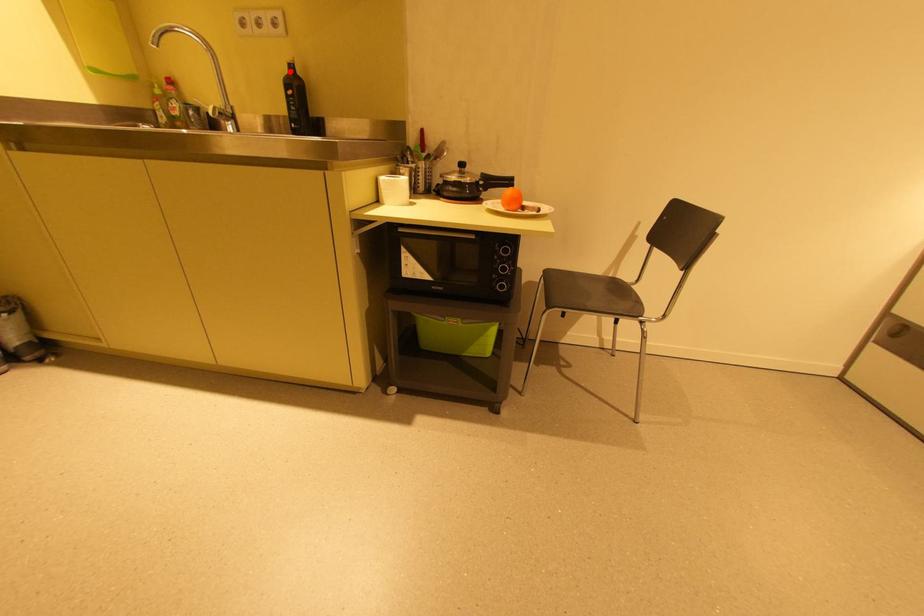
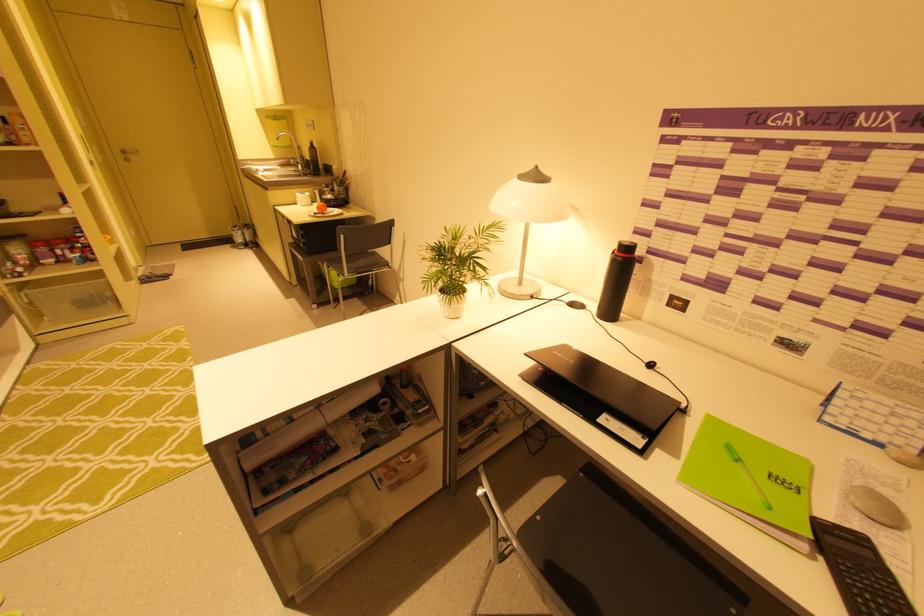
In the second image, find the point that corresponds to the highlighted location in the first image.

(313, 146)